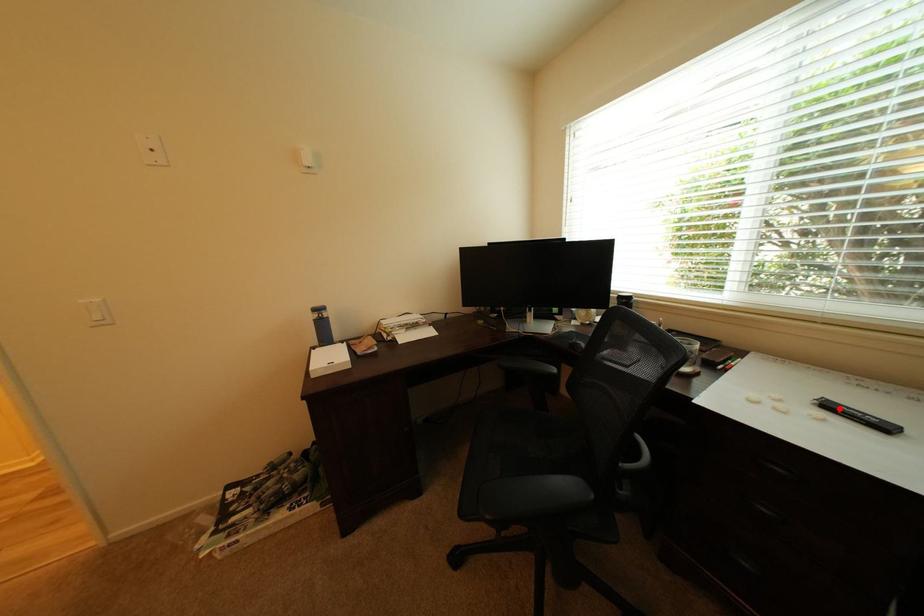
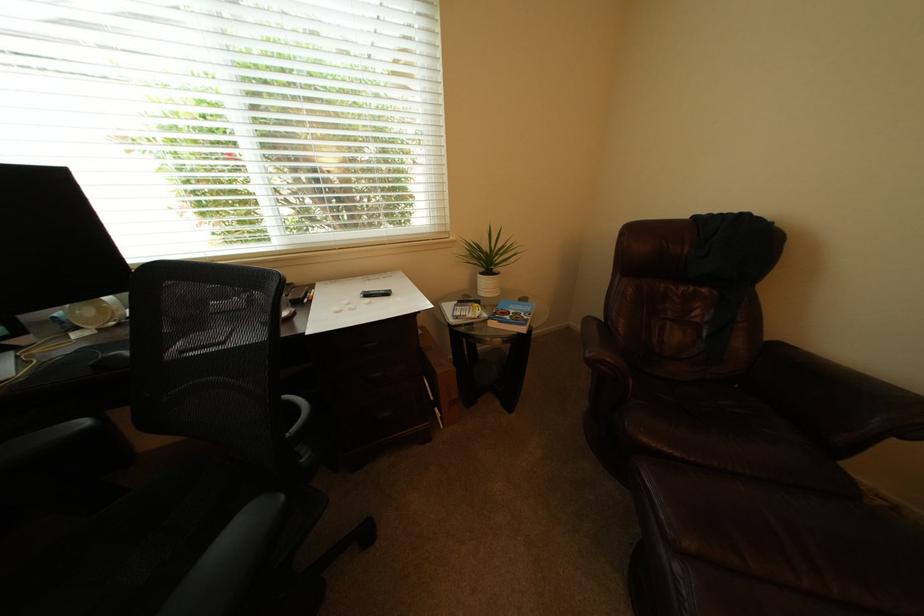
Locate, in the second image, the point that corresponds to the highlighted location in the first image.

(378, 297)